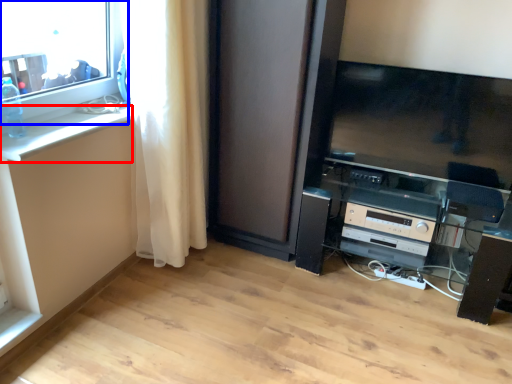
Question: Which object is further to the camera taking this photo, counter top (highlighted by a red box) or window (highlighted by a blue box)?

Choices:
 (A) counter top
 (B) window

Answer: (A)